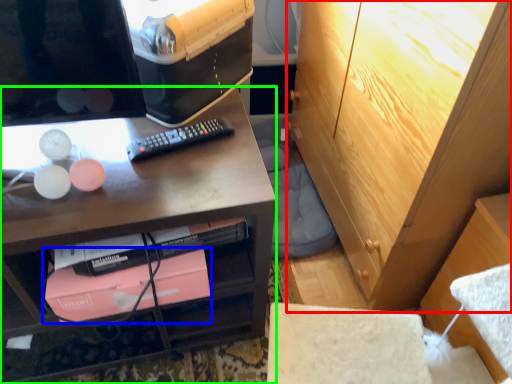
Question: Which object is the farthest from cabinetry (highlighted by a red box)? Choose among these: book (highlighted by a blue box) or desk (highlighted by a green box).

Choices:
 (A) book
 (B) desk

Answer: (A)